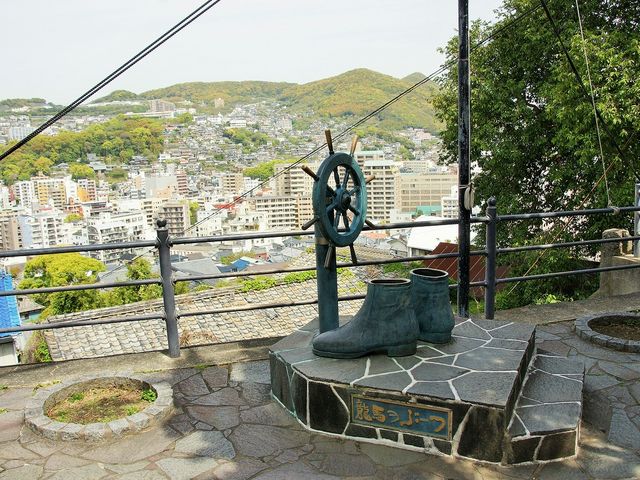
This screenshot has width=640, height=480. What are the coordinates of `plaque` in the screenshot? It's located at (x=409, y=418).